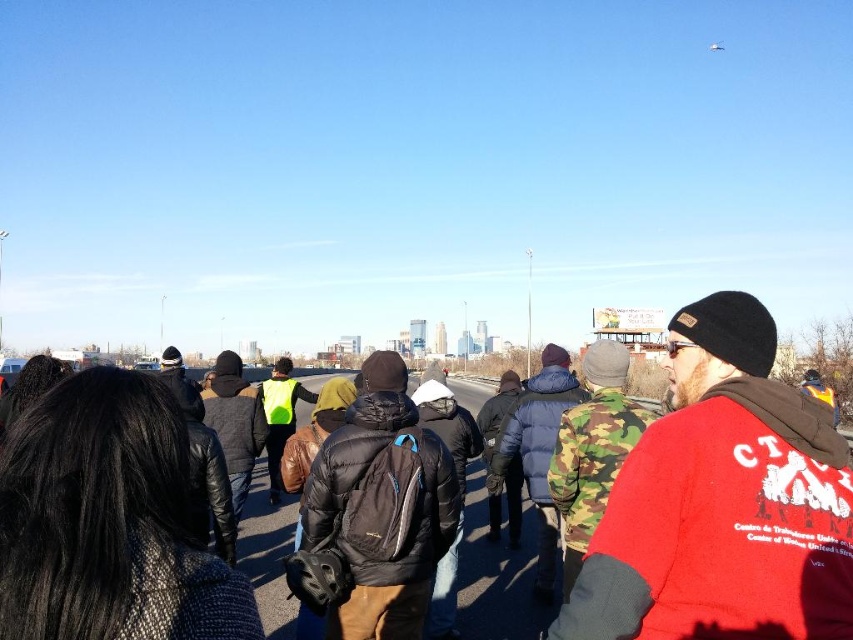
You are standing in the scene and want to determine which of the two points, point (437,492) or point (589,442), is nearer to you. Based on the image, which point is closer?

Point (437,492) is closer to the viewer than point (589,442).

You are a photographer trying to capture a photo of the city skyline with both the red fleece jacket at center and the black puffy jacket at center in the frame. Based on their positions, which jacket should you adjust your camera to focus on first to ensure both are in the shot?

The red fleece jacket at center is to the right of the black puffy jacket at center, so you should focus on the black puffy jacket at center first to ensure both are captured in the frame.

In the scene shown: You are a photographer trying to capture both the black puffy jacket at center and the camo fabric jacket at center in the same frame. Based on their positions, which jacket should you focus on first to ensure both are in the shot?

The black puffy jacket at center is below the camo fabric jacket at center, so you should focus on the camo fabric jacket at center first to ensure both are in the shot.